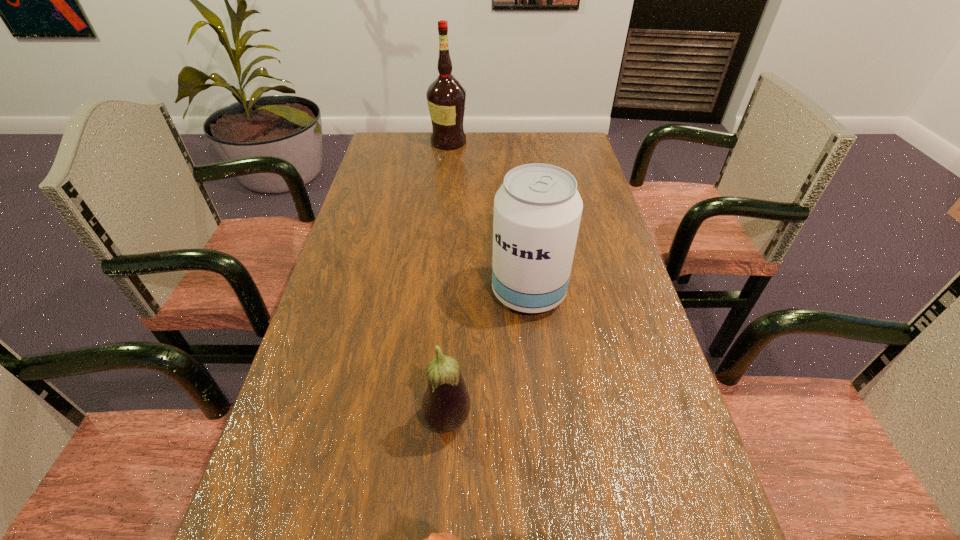
I want to click on vacant area that satisfies the following two spatial constraints: 1. on the label of the taller alcohol; 2. on the right side of the eggplant, so click(419, 421).

Identify the location of free spot that satisfies the following two spatial constraints: 1. on the label of the taller alcohol; 2. on the right side of the shorter alcohol. (433, 293).

The image size is (960, 540). I want to click on blank space that satisfies the following two spatial constraints: 1. on the back side of the eggplant; 2. on the label of the left alcohol, so click(x=464, y=142).

You are a GUI agent. You are given a task and a screenshot of the screen. Output one action in this format:
    pyautogui.click(x=<x>, y=<y>)
    Task: Click on the free space that satisfies the following two spatial constraints: 1. on the label of the eggplant; 2. on the left side of the tallest object
    
    Given the screenshot: What is the action you would take?
    pyautogui.click(x=419, y=421)

You are a GUI agent. You are given a task and a screenshot of the screen. Output one action in this format:
    pyautogui.click(x=<x>, y=<y>)
    Task: Click on the vacant space that satisfies the following two spatial constraints: 1. on the label of the right alcohol; 2. on the right side of the taller alcohol
    The width and height of the screenshot is (960, 540).
    Given the screenshot: What is the action you would take?
    pyautogui.click(x=433, y=293)

I want to click on vacant position in the image that satisfies the following two spatial constraints: 1. on the back side of the second nearest object; 2. on the label of the farthest object, so click(x=464, y=142).